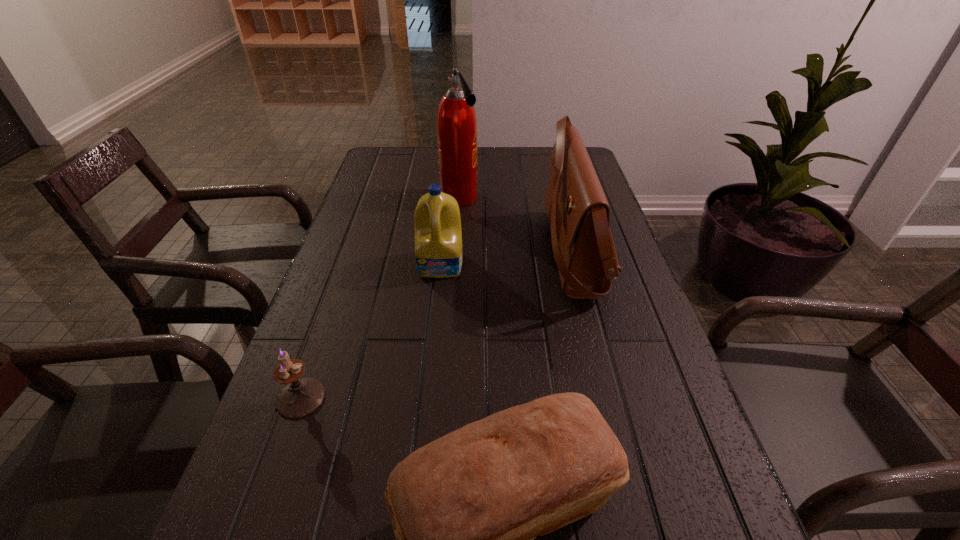
Where is `vacant area situated 0.150m on the front of the candle holder`? vacant area situated 0.150m on the front of the candle holder is located at coordinates (260, 511).

Locate an element on the screen. object that is at the left edge is located at coordinates (300, 397).

I want to click on object present at the right edge, so click(x=578, y=213).

In the image, there is a desktop. Identify the location of free space at the far edge. (481, 156).

In order to click on blank space at the left edge of the desktop in this screenshot , I will do `click(355, 293)`.

I want to click on vacant area at the right edge of the desktop, so click(x=615, y=367).

Identify the location of free space at the far left corner. The image size is (960, 540). (414, 161).

Find the location of a particular element. This screenshot has height=540, width=960. free point between the second tallest object and the detergent is located at coordinates (508, 258).

I want to click on object that ranks as the second closest to the fourth farthest object, so click(x=438, y=236).

Find the location of a particular element. The image size is (960, 540). the third closest object to the nearest object is located at coordinates (438, 236).